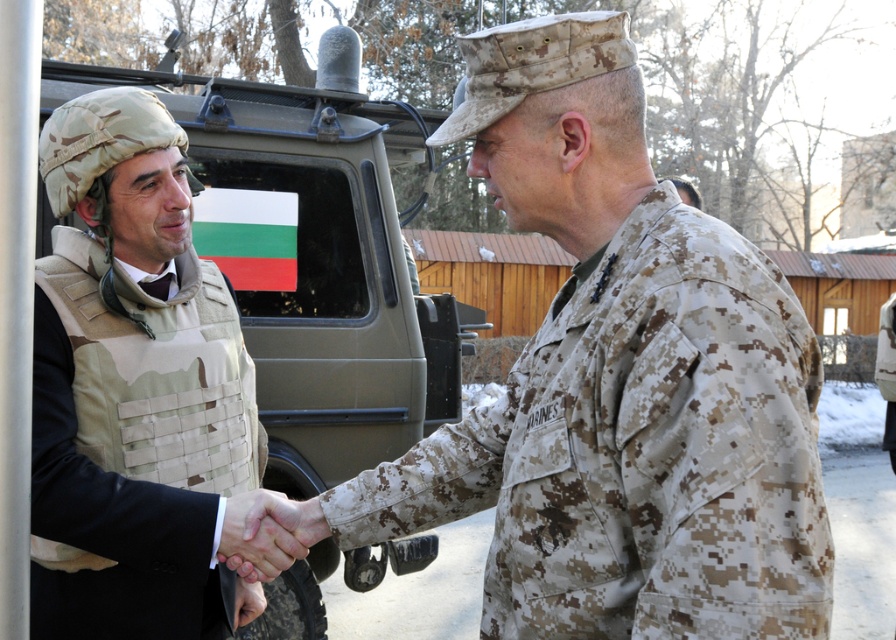
Looking at this image, can you confirm if camouflage fabric vest at center is positioned above smooth skin handshake at center?

Indeed, camouflage fabric vest at center is positioned over smooth skin handshake at center.

Does camouflage fabric vest at center have a greater width compared to smooth skin handshake at center?

Yes.

At what (x,y) coordinates should I click in order to perform the action: click on camouflage fabric vest at center. Please return your answer as a coordinate pair (x, y). The height and width of the screenshot is (640, 896). Looking at the image, I should click on (132, 387).

Can you confirm if camouflage fabric uniform at center is positioned below smooth skin handshake at center?

Incorrect, camouflage fabric uniform at center is not positioned below smooth skin handshake at center.

Measure the distance between point (x=688, y=410) and camera.

The distance of point (x=688, y=410) from camera is 4.62 feet.

At what (x,y) coordinates should I click in order to perform the action: click on camouflage fabric uniform at center. Please return your answer as a coordinate pair (x, y). Looking at the image, I should click on (636, 452).

Which is below, camouflage fabric uniform at center or camouflage fabric vest at center?

Positioned lower is camouflage fabric uniform at center.

Identify the location of camouflage fabric uniform at center. (636, 452).